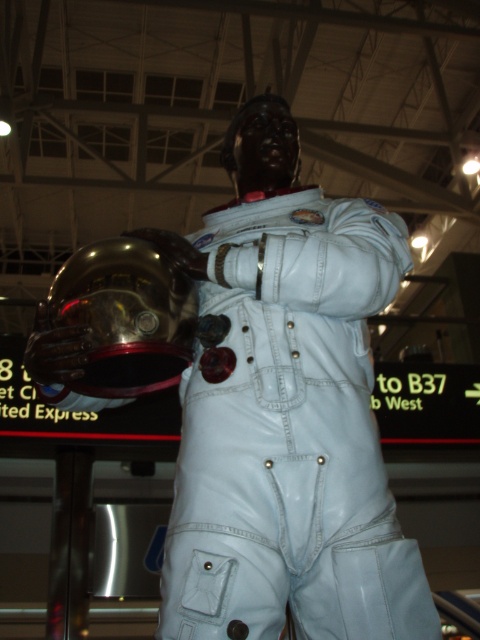
You are standing in the room with the white glossy astronaut at center. You want to take a photo of the astronaut using a camera that requires a minimum distance of 4 feet between the camera and the subject for clear focus. Can you achieve a clear photo with the camera at its current position?

A: The white glossy astronaut at center and camera are 4.29 feet apart from each other. Since 4.29 feet is greater than the minimum required 4 feet, the camera can achieve a clear photo at its current position.

You are an astronaut preparing for a mission and notice the white glossy astronaut at center and the glossy metallic helmet at center in your path. Which object is blocking your way more? Please explain based on their positions.

The white glossy astronaut at center is positioned over the glossy metallic helmet at center, meaning the astronaut is closer to you and thus blocking the path more than the helmet.

You are a technician in a space facility. You need to place a 12 inch long tool between the white glossy astronaut at center and the glossy metallic helmet at center. Is there enough space between them for the tool?

The white glossy astronaut at center is 12.26 inches away from the glossy metallic helmet at center. Since the tool is 12 inches long, there is enough space between them to place the tool.